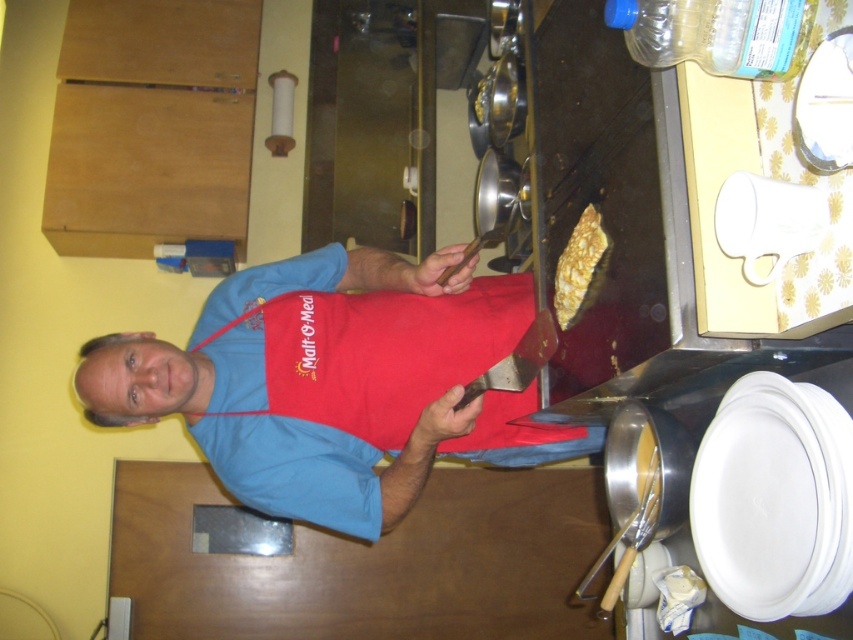
Question: Which object is farther from the camera taking this photo?

Choices:
 (A) golden crispy pancake at upper right
 (B) blue fabric apron at center

Answer: (B)

Question: Can you confirm if blue fabric apron at center is thinner than golden crispy pancake at upper right?

Choices:
 (A) yes
 (B) no

Answer: (B)

Question: Which point appears closest to the camera in this image?

Choices:
 (A) (202, 435)
 (B) (567, 289)

Answer: (B)

Question: Is blue fabric apron at center below golden crispy pancake at upper right?

Choices:
 (A) yes
 (B) no

Answer: (A)

Question: Is blue fabric apron at center closer to the viewer compared to golden crispy pancake at upper right?

Choices:
 (A) no
 (B) yes

Answer: (A)